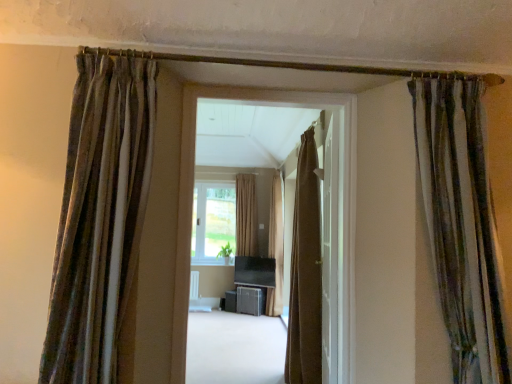
The width and height of the screenshot is (512, 384). Describe the element at coordinates (256, 276) in the screenshot. I see `matte black tv at center, which is counted as the 1th furniture, starting from the top` at that location.

Where is `smooth beige carpet at center`? This screenshot has width=512, height=384. smooth beige carpet at center is located at coordinates (234, 348).

What is the approximate width of metallic gray cabinet at center, which is counted as the second furniture, starting from the bottom?

metallic gray cabinet at center, which is counted as the second furniture, starting from the bottom, is 8.16 inches in width.

Image resolution: width=512 pixels, height=384 pixels. What are the coordinates of `brown textured curtain at center, positioned as the 2th curtain in right-to-left order` in the screenshot? It's located at (305, 273).

The height and width of the screenshot is (384, 512). Identify the location of white glossy screen door at center. (330, 245).

Which of these two, metallic gray cabinet at center, marked as the second furniture in a top-to-bottom arrangement, or striped fabric curtain at right, the fifth curtain from the left, stands taller?

striped fabric curtain at right, the fifth curtain from the left, is taller.

Considering the relative sizes of metallic gray cabinet at center, which is counted as the second furniture, starting from the bottom, and striped fabric curtain at right, the fifth curtain from the left, in the image provided, is metallic gray cabinet at center, which is counted as the second furniture, starting from the bottom, smaller than striped fabric curtain at right, the fifth curtain from the left,?

Indeed, metallic gray cabinet at center, which is counted as the second furniture, starting from the bottom, has a smaller size compared to striped fabric curtain at right, the fifth curtain from the left.

Is the surface of metallic gray cabinet at center, which is counted as the second furniture, starting from the bottom, in direct contact with striped fabric curtain at right, which is the 1th curtain in right-to-left order?

No, metallic gray cabinet at center, which is counted as the second furniture, starting from the bottom, is not beside striped fabric curtain at right, which is the 1th curtain in right-to-left order.

Can you confirm if matte black tv at center, which is counted as the 1th furniture, starting from the top, is wider than smooth beige carpet at center?

No, matte black tv at center, which is counted as the 1th furniture, starting from the top, is not wider than smooth beige carpet at center.

Is matte black tv at center, the 3th furniture ordered from the bottom, spatially inside smooth beige carpet at center, or outside of it?

matte black tv at center, the 3th furniture ordered from the bottom, is spatially situated outside smooth beige carpet at center.

At what (x,y) coordinates should I click in order to perform the action: click on plain that is under the matte black tv at center, the 3th furniture ordered from the bottom (from a real-world perspective). Please return your answer as a coordinate pair (x, y). Looking at the image, I should click on (234, 348).

Are matte black tv at center, the 3th furniture ordered from the bottom, and smooth beige carpet at center making contact?

No.

Considering the positions of point (138, 148) and point (225, 316), is point (138, 148) closer or farther from the camera than point (225, 316)?

Point (138, 148) is positioned closer to the camera compared to point (225, 316).

The image size is (512, 384). What are the coordinates of `the 4th curtain positioned above the smooth beige carpet at center (from a real-world perspective)` in the screenshot? It's located at (100, 216).

In the image, is velvet striped curtain at upper left, placed as the 5th curtain when sorted from back to front, on the left side or the right side of smooth beige carpet at center?

velvet striped curtain at upper left, placed as the 5th curtain when sorted from back to front, is positioned on smooth beige carpet at center's left side.

Are velvet striped curtain at upper left, placed as the 1th curtain when sorted from left to right, and smooth beige carpet at center far apart?

Yes, velvet striped curtain at upper left, placed as the 1th curtain when sorted from left to right, and smooth beige carpet at center are located far from each other.

Is striped fabric curtain at right, the 4th curtain from the back, placed right next to velvet striped curtain at upper left, placed as the 1th curtain when sorted from left to right?

No, striped fabric curtain at right, the 4th curtain from the back, is not beside velvet striped curtain at upper left, placed as the 1th curtain when sorted from left to right.

Does striped fabric curtain at right, which is the 1th curtain in right-to-left order, have a smaller size compared to velvet striped curtain at upper left, placed as the 5th curtain when sorted from back to front?

Indeed, striped fabric curtain at right, which is the 1th curtain in right-to-left order, has a smaller size compared to velvet striped curtain at upper left, placed as the 5th curtain when sorted from back to front.

Which object is thinner, striped fabric curtain at right, which is the 1th curtain in right-to-left order, or velvet striped curtain at upper left, acting as the fifth curtain starting from the right?

Thinner between the two is velvet striped curtain at upper left, acting as the fifth curtain starting from the right.

How many degrees apart are the facing directions of striped fabric curtain at right, which is the 1th curtain in right-to-left order, and velvet striped curtain at upper left, marked as the first curtain in a front-to-back arrangement?

There is a 0.00333-degree angle between the facing directions of striped fabric curtain at right, which is the 1th curtain in right-to-left order, and velvet striped curtain at upper left, marked as the first curtain in a front-to-back arrangement.

Locate an element on the screen. curtain located on the left of smooth beige carpet at center is located at coordinates (100, 216).

Is point (208, 350) behind point (104, 310)?

Yes, point (208, 350) is farther from viewer.

Is smooth beige carpet at center next to velvet striped curtain at upper left, placed as the 1th curtain when sorted from left to right, and touching it?

No.

From the image's perspective, relative to velvet striped curtain at upper left, acting as the fifth curtain starting from the right, is smooth beige carpet at center above or below?

smooth beige carpet at center is situated lower than velvet striped curtain at upper left, acting as the fifth curtain starting from the right, in the image.

Is brown fabric curtain at center looking in the opposite direction of matte black tv at center, which is counted as the 1th furniture, starting from the top?

Yes.

From the image's perspective, is brown fabric curtain at center located above matte black tv at center, the 3th furniture ordered from the bottom?

Yes, from the image's perspective, brown fabric curtain at center is above matte black tv at center, the 3th furniture ordered from the bottom.

How much distance is there between brown fabric curtain at center and matte black tv at center, which is counted as the 1th furniture, starting from the top?

brown fabric curtain at center is 15.79 feet away from matte black tv at center, which is counted as the 1th furniture, starting from the top.

Is brown fabric curtain at center further to the viewer compared to matte black tv at center, which is counted as the 1th furniture, starting from the top?

No, brown fabric curtain at center is closer to the viewer.

Does beige fabric curtain at center, acting as the 2th curtain starting from the left, have a greater height compared to metallic gray cabinet at center, which is counted as the second furniture, starting from the bottom?

Yes, beige fabric curtain at center, acting as the 2th curtain starting from the left, is taller than metallic gray cabinet at center, which is counted as the second furniture, starting from the bottom.

What's the angular difference between beige fabric curtain at center, the 1th curtain when ordered from back to front, and metallic gray cabinet at center, marked as the second furniture in a top-to-bottom arrangement,'s facing directions?

The facing directions of beige fabric curtain at center, the 1th curtain when ordered from back to front, and metallic gray cabinet at center, marked as the second furniture in a top-to-bottom arrangement, are 20.3 degrees apart.

From the image's perspective, would you say beige fabric curtain at center, the fifth curtain from the front, is positioned over metallic gray cabinet at center, which is counted as the second furniture, starting from the bottom?

Indeed, from the image's perspective, beige fabric curtain at center, the fifth curtain from the front, is shown above metallic gray cabinet at center, which is counted as the second furniture, starting from the bottom.

Considering the positions of objects beige fabric curtain at center, the fifth curtain from the front, and metallic gray cabinet at center, which is counted as the second furniture, starting from the bottom, in the image provided, who is more to the left, beige fabric curtain at center, the fifth curtain from the front, or metallic gray cabinet at center, which is counted as the second furniture, starting from the bottom,?

beige fabric curtain at center, the fifth curtain from the front.

From a real-world perspective, which curtain is the 3rd one above the metallic gray cabinet at center, marked as the second furniture in a top-to-bottom arrangement? Please provide its 2D coordinates.

[(461, 223)]

Locate an element on the screen. The height and width of the screenshot is (384, 512). plain below the matte black tv at center, which is counted as the 1th furniture, starting from the top (from a real-world perspective) is located at coordinates (234, 348).

Based on their spatial positions, is smooth beige carpet at center or matte black speaker at center, arranged as the 3th furniture when viewed from the top, further from white glossy screen door at center?

Among the two, matte black speaker at center, arranged as the 3th furniture when viewed from the top, is located further to white glossy screen door at center.

Based on the photo, when comparing their distances from smooth beige carpet at center, does brown textured curtain at center, placed as the second curtain when sorted from back to front, or matte black speaker at center, arranged as the 3th furniture when viewed from the top, seem further?

Among the two, matte black speaker at center, arranged as the 3th furniture when viewed from the top, is located further to smooth beige carpet at center.

Which object lies nearer to the anchor point metallic gray cabinet at center, marked as the second furniture in a top-to-bottom arrangement, matte black speaker at center, placed as the first furniture when sorted from bottom to top, or brown fabric curtain at center?

The object closer to metallic gray cabinet at center, marked as the second furniture in a top-to-bottom arrangement, is matte black speaker at center, placed as the first furniture when sorted from bottom to top.

Based on their spatial positions, is metallic gray cabinet at center, marked as the second furniture in a top-to-bottom arrangement, or beige fabric curtain at center, the 1th curtain when ordered from back to front, closer to smooth beige carpet at center?

metallic gray cabinet at center, marked as the second furniture in a top-to-bottom arrangement, lies closer to smooth beige carpet at center than the other object.

When comparing their distances from metallic gray cabinet at center, which is counted as the second furniture, starting from the bottom, does matte black tv at center, the 3th furniture ordered from the bottom, or beige fabric curtain at center, the fifth curtain from the front, seem closer?

matte black tv at center, the 3th furniture ordered from the bottom, is positioned closer to the anchor metallic gray cabinet at center, which is counted as the second furniture, starting from the bottom.

Looking at the image, which one is located further to white glossy screen door at center, brown fabric curtain at center or brown textured curtain at center, the third curtain viewed from the right?

brown textured curtain at center, the third curtain viewed from the right, is further to white glossy screen door at center.

Considering their positions, is brown textured curtain at center, acting as the third curtain starting from the front, positioned further to brown textured curtain at center, placed as the second curtain when sorted from back to front, than matte black speaker at center, arranged as the 3th furniture when viewed from the top?

brown textured curtain at center, acting as the third curtain starting from the front.

Looking at the image, which one is located closer to velvet striped curtain at upper left, marked as the first curtain in a front-to-back arrangement, matte black tv at center, which is counted as the 1th furniture, starting from the top, or metallic gray cabinet at center, marked as the second furniture in a top-to-bottom arrangement?

matte black tv at center, which is counted as the 1th furniture, starting from the top, lies closer to velvet striped curtain at upper left, marked as the first curtain in a front-to-back arrangement, than the other object.

This screenshot has height=384, width=512. Find the location of `curtain between brown textured curtain at center, positioned as the 2th curtain in right-to-left order, and metallic gray cabinet at center, marked as the second furniture in a top-to-bottom arrangement, along the z-axis`. curtain between brown textured curtain at center, positioned as the 2th curtain in right-to-left order, and metallic gray cabinet at center, marked as the second furniture in a top-to-bottom arrangement, along the z-axis is located at coordinates (276, 246).

The width and height of the screenshot is (512, 384). I want to click on plain between velvet striped curtain at upper left, placed as the 5th curtain when sorted from back to front, and beige fabric curtain at center, the 1th curtain when ordered from back to front, along the z-axis, so click(234, 348).

This screenshot has height=384, width=512. I want to click on window frame positioned between striped fabric curtain at right, the fifth curtain from the left, and metallic gray cabinet at center, which is counted as the second furniture, starting from the bottom, from near to far, so click(191, 205).

At what (x,y) coordinates should I click in order to perform the action: click on window frame situated between velvet striped curtain at upper left, marked as the first curtain in a front-to-back arrangement, and striped fabric curtain at right, the 2th curtain in the front-to-back sequence, from left to right. Please return your answer as a coordinate pair (x, y). The width and height of the screenshot is (512, 384). Looking at the image, I should click on (191, 205).